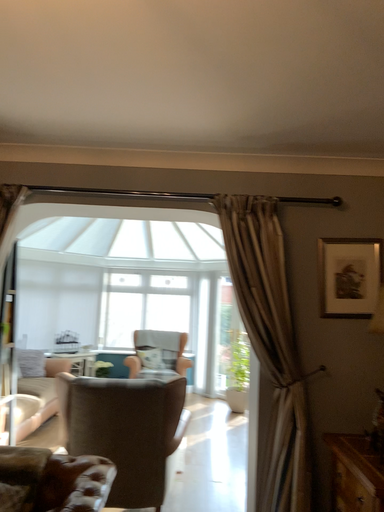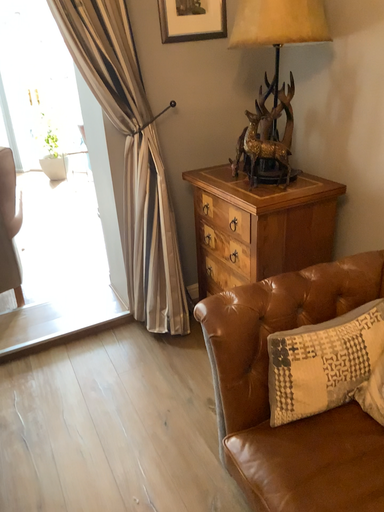
Question: How did the camera likely rotate when shooting the video?

Choices:
 (A) rotated downward
 (B) rotated upward

Answer: (A)